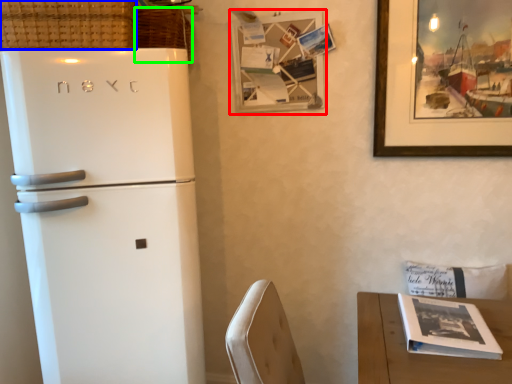
Question: Which object is positioned closest to picture frame (highlighted by a red box)? Select from basket (highlighted by a blue box) and basket (highlighted by a green box).

Choices:
 (A) basket
 (B) basket

Answer: (B)